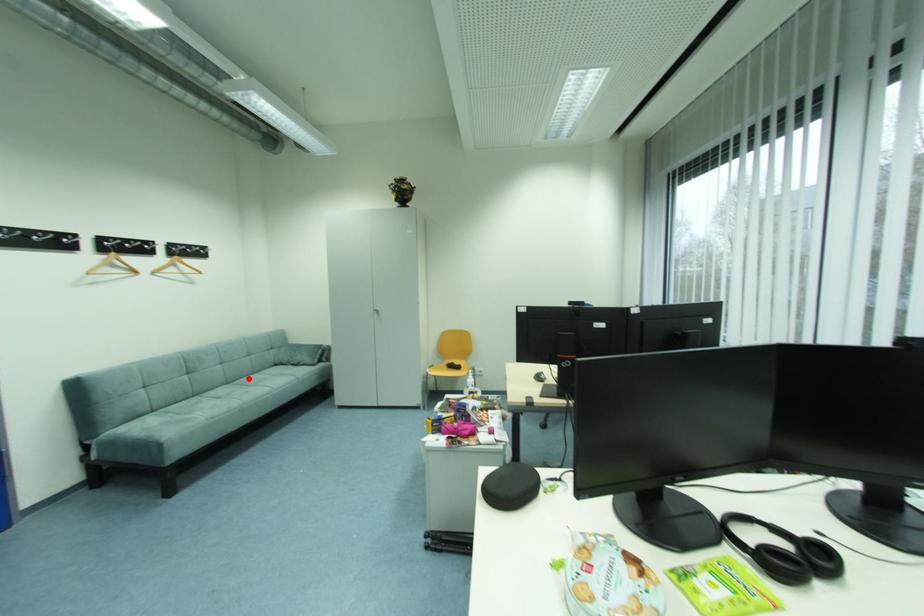
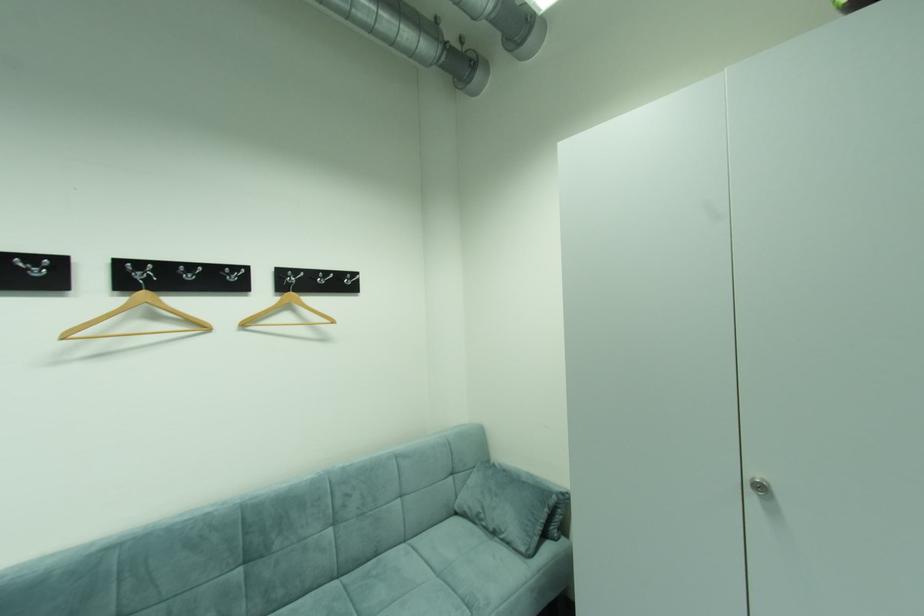
Find the pixel in the second image that matches the highlighted location in the first image.

(383, 554)